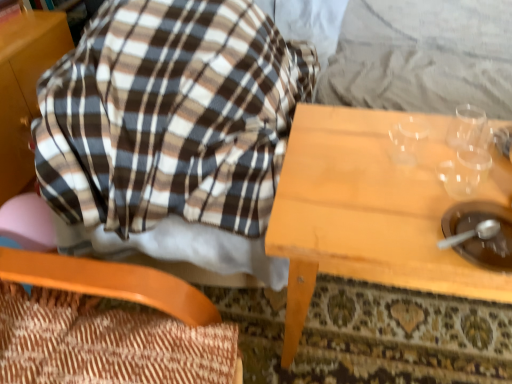
Question: Is wooden textured chair at left to the left of brown matte bowl at lower right from the viewer's perspective?

Choices:
 (A) yes
 (B) no

Answer: (A)

Question: Could you tell me if wooden textured chair at left is turned towards brown matte bowl at lower right?

Choices:
 (A) yes
 (B) no

Answer: (A)

Question: Considering the relative sizes of wooden textured chair at left and brown matte bowl at lower right in the image provided, is wooden textured chair at left wider than brown matte bowl at lower right?

Choices:
 (A) no
 (B) yes

Answer: (B)

Question: From the image's perspective, would you say wooden textured chair at left is positioned over brown matte bowl at lower right?

Choices:
 (A) yes
 (B) no

Answer: (B)

Question: Can we say wooden textured chair at left lies outside brown matte bowl at lower right?

Choices:
 (A) no
 (B) yes

Answer: (B)

Question: From the image's perspective, is wooden table at center positioned above or below brown matte bowl at lower right?

Choices:
 (A) below
 (B) above

Answer: (A)

Question: Based on their sizes in the image, would you say wooden table at center is bigger or smaller than brown matte bowl at lower right?

Choices:
 (A) small
 (B) big

Answer: (B)

Question: From a real-world perspective, is wooden table at center above or below brown matte bowl at lower right?

Choices:
 (A) below
 (B) above

Answer: (A)

Question: Is wooden table at center taller or shorter than brown matte bowl at lower right?

Choices:
 (A) short
 (B) tall

Answer: (B)

Question: Considering the positions of brown matte bowl at lower right and brown plaid blanket at upper left in the image, is brown matte bowl at lower right bigger or smaller than brown plaid blanket at upper left?

Choices:
 (A) small
 (B) big

Answer: (A)

Question: Considering the positions of point (465, 231) and point (119, 168), is point (465, 231) closer or farther from the camera than point (119, 168)?

Choices:
 (A) farther
 (B) closer

Answer: (B)

Question: From the image's perspective, is brown matte bowl at lower right positioned above or below brown plaid blanket at upper left?

Choices:
 (A) below
 (B) above

Answer: (A)

Question: Is brown matte bowl at lower right inside or outside of brown plaid blanket at upper left?

Choices:
 (A) outside
 (B) inside

Answer: (A)

Question: Considering the positions of brown plaid blanket at upper left and wooden textured chair at left in the image, is brown plaid blanket at upper left taller or shorter than wooden textured chair at left?

Choices:
 (A) short
 (B) tall

Answer: (B)

Question: Based on their positions, is brown plaid blanket at upper left located to the left or right of wooden textured chair at left?

Choices:
 (A) left
 (B) right

Answer: (B)